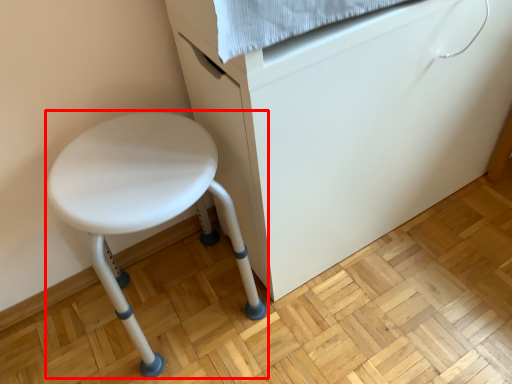
Question: In this image, where is stool (annotated by the red box) located relative to furniture?

Choices:
 (A) left
 (B) right

Answer: (A)